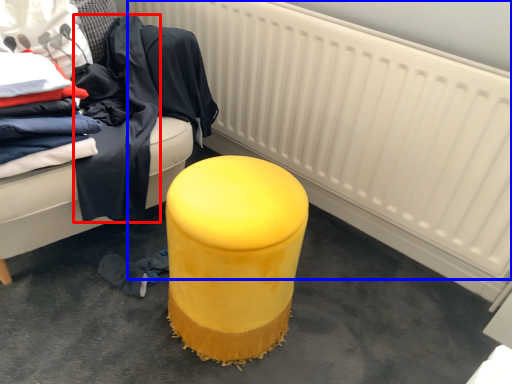
Question: Which object appears farthest to the camera in this image, clothing (highlighted by a red box) or radiator (highlighted by a blue box)?

Choices:
 (A) clothing
 (B) radiator

Answer: (A)